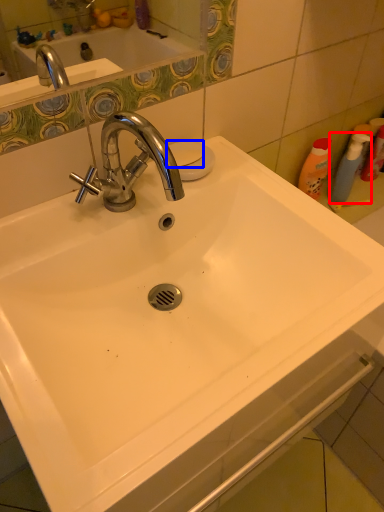
Question: Which of the following is the closest to the observer, cleaning product (highlighted by a red box) or soap (highlighted by a blue box)?

Choices:
 (A) cleaning product
 (B) soap

Answer: (B)